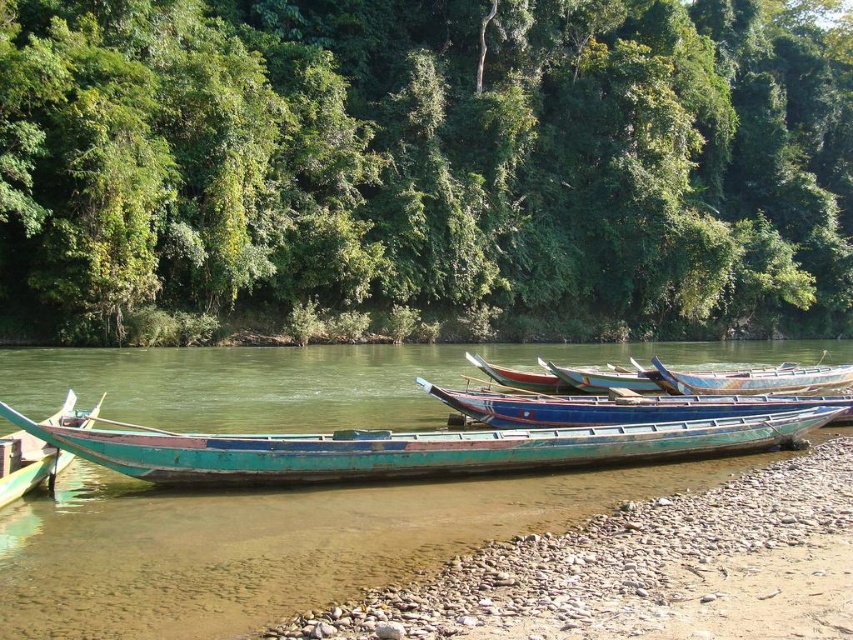
Question: Is green leafy trees at upper center wider than wooden planks boat at center?

Choices:
 (A) yes
 (B) no

Answer: (A)

Question: Can you confirm if teal wooden boat at center is smaller than green wooden boat at lower left?

Choices:
 (A) yes
 (B) no

Answer: (B)

Question: Which of the following is the farthest from the observer?

Choices:
 (A) (273, 22)
 (B) (113, 467)
 (C) (665, 385)

Answer: (A)

Question: Which point is farther to the camera?

Choices:
 (A) (68, 392)
 (B) (538, 410)
 (C) (815, 426)

Answer: (A)

Question: Which point appears farthest from the camera in this image?

Choices:
 (A) (44, 445)
 (B) (55, 232)
 (C) (728, 372)

Answer: (B)

Question: Does green leafy trees at upper center lie behind green wooden boat at lower left?

Choices:
 (A) no
 (B) yes

Answer: (B)